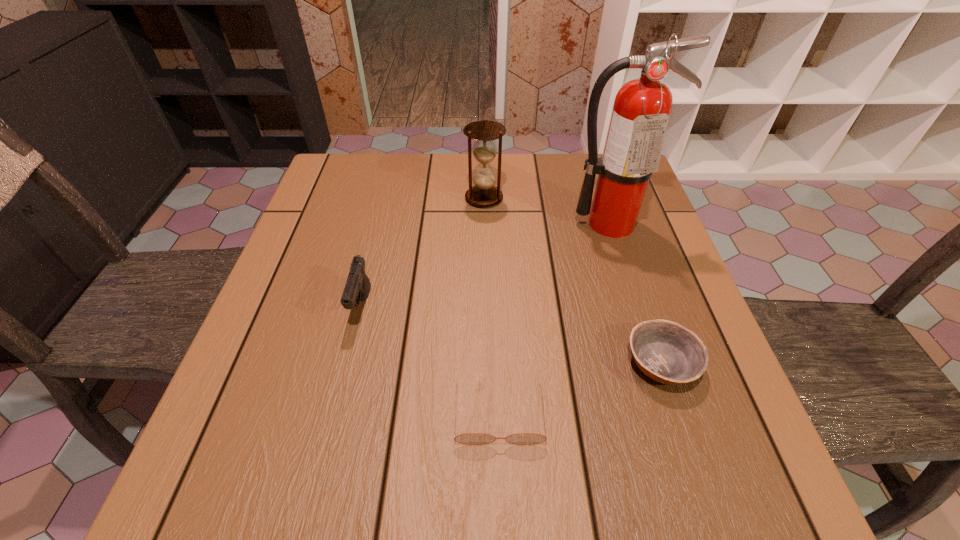
This screenshot has height=540, width=960. Find the location of `free space between the bowl and the sunglasses`. free space between the bowl and the sunglasses is located at coordinates (581, 389).

This screenshot has height=540, width=960. I want to click on vacant area that lies between the sunglasses and the bowl, so click(x=581, y=389).

What are the coordinates of `free space between the leftmost object and the sunglasses` in the screenshot? It's located at (431, 360).

Identify the location of free space between the bowl and the sunglasses. pyautogui.click(x=581, y=389).

Locate an element on the screen. This screenshot has height=540, width=960. free area in between the sunglasses and the hourglass is located at coordinates (492, 306).

The image size is (960, 540). In order to click on vacant region between the bowl and the sunglasses in this screenshot , I will do `click(581, 389)`.

The height and width of the screenshot is (540, 960). Find the location of `free area in between the leftmost object and the bowl`. free area in between the leftmost object and the bowl is located at coordinates (512, 335).

Where is `blank region between the sunglasses and the fourth shortest object`? The height and width of the screenshot is (540, 960). blank region between the sunglasses and the fourth shortest object is located at coordinates pyautogui.click(x=492, y=306).

Find the location of a particular element. This screenshot has height=540, width=960. object that can be found as the fourth closest to the bowl is located at coordinates (357, 287).

Identify which object is located as the nearest to the bowl. Please provide its 2D coordinates. Your answer should be formatted as a tuple, i.e. [(x, y)], where the tuple contains the x and y coordinates of a point satisfying the conditions above.

[(469, 438)]